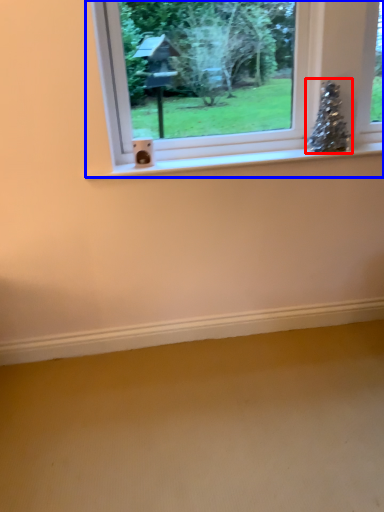
Question: Which of the following is the farthest to the observer, christmas tree (highlighted by a red box) or window (highlighted by a blue box)?

Choices:
 (A) christmas tree
 (B) window

Answer: (A)